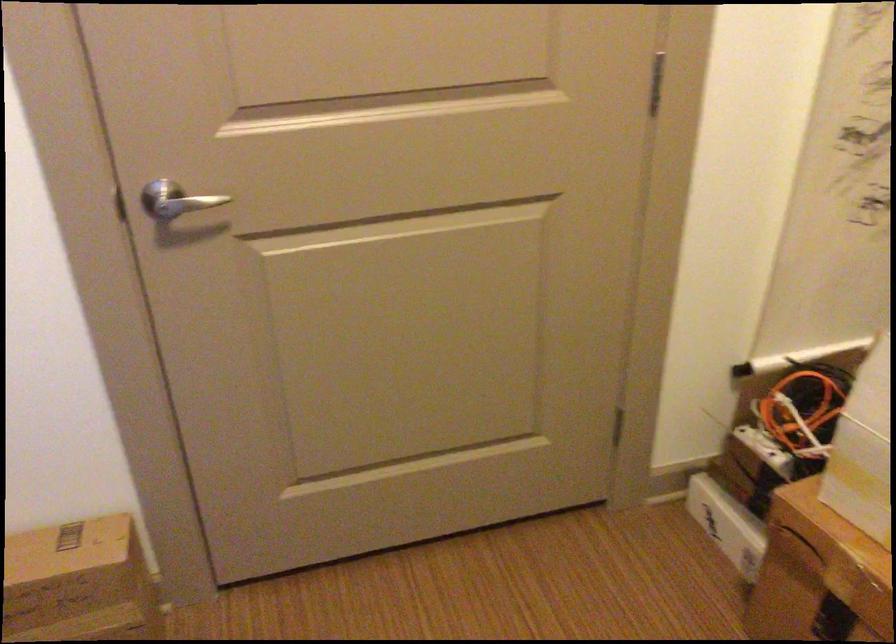
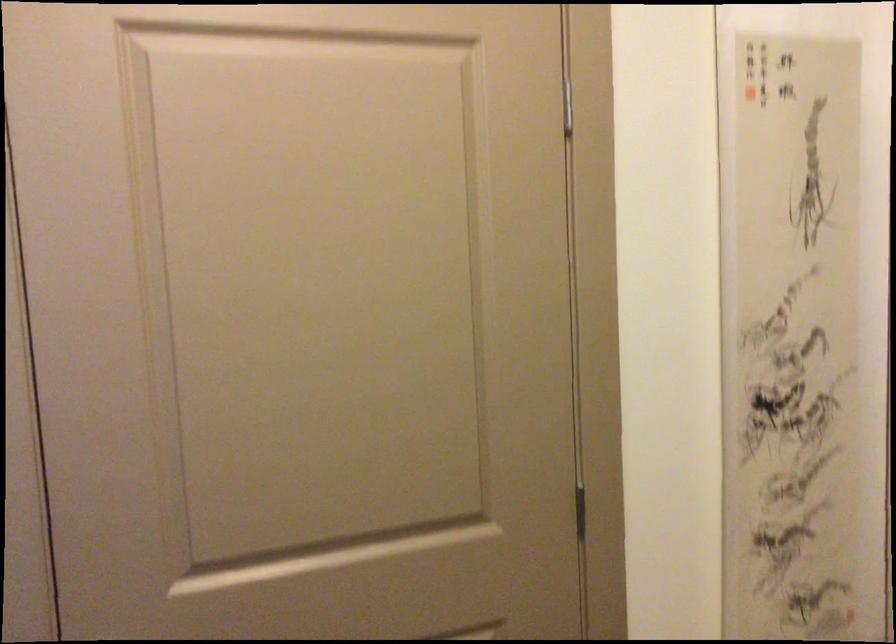
Question: The first image is from the beginning of the video and the second image is from the end. How did the camera likely rotate when shooting the video?

Choices:
 (A) Left
 (B) Right
 (C) Up
 (D) Down

Answer: (C)